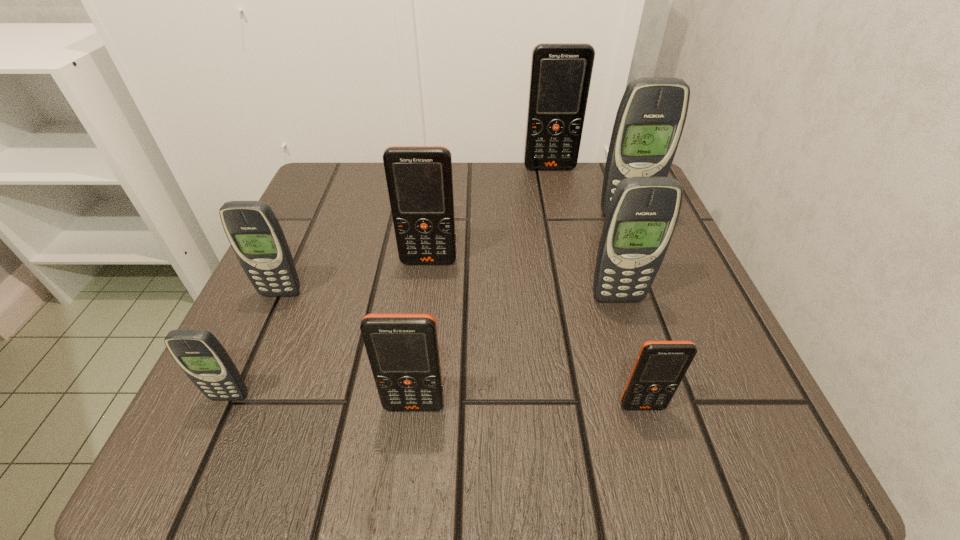
Image resolution: width=960 pixels, height=540 pixels. Identify the location of vacant point located between the third biggest orange cellular telephone and the smallest gray cellular telephone. (322, 401).

You are a GUI agent. You are given a task and a screenshot of the screen. Output one action in this format:
    pyautogui.click(x=<x>, y=<y>)
    Task: Click on the object that is the fifth closest to the smallest orange cellular telephone
    
    Given the screenshot: What is the action you would take?
    pyautogui.click(x=200, y=355)

You are a GUI agent. You are given a task and a screenshot of the screen. Output one action in this format:
    pyautogui.click(x=<x>, y=<y>)
    Task: Click on the object that is the seventh closest one to the farthest cellular telephone
    
    Given the screenshot: What is the action you would take?
    pyautogui.click(x=200, y=355)

In order to click on cellular telephone that is the third closest to the biggest orange cellular telephone in this screenshot , I will do `click(642, 215)`.

Where is `cellular telephone object that ranks as the fifth closest to the third biggest orange cellular telephone`? This screenshot has width=960, height=540. cellular telephone object that ranks as the fifth closest to the third biggest orange cellular telephone is located at coordinates (642, 215).

Select which orange cellular telephone appears as the closest to the smallest orange cellular telephone. Please provide its 2D coordinates. Your answer should be formatted as a tuple, i.e. [(x, y)], where the tuple contains the x and y coordinates of a point satisfying the conditions above.

[(403, 351)]

Where is `the third closest orange cellular telephone relative to the farthest gray cellular telephone`? Image resolution: width=960 pixels, height=540 pixels. the third closest orange cellular telephone relative to the farthest gray cellular telephone is located at coordinates (660, 366).

Point out which gray cellular telephone is positioned as the second nearest to the nearest gray cellular telephone. Please provide its 2D coordinates. Your answer should be formatted as a tuple, i.e. [(x, y)], where the tuple contains the x and y coordinates of a point satisfying the conditions above.

[(642, 215)]

Identify the location of the second closest gray cellular telephone to the third biggest gray cellular telephone. This screenshot has width=960, height=540. (642, 215).